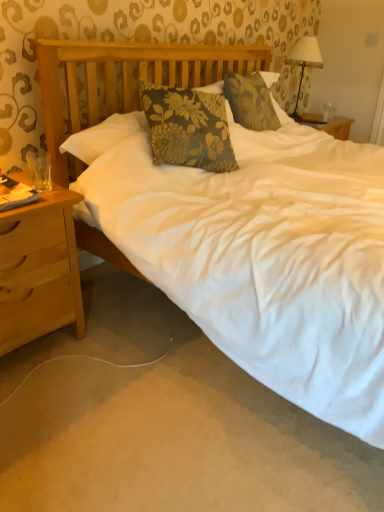
This screenshot has height=512, width=384. Describe the element at coordinates (304, 62) in the screenshot. I see `white fabric lampshade at upper right` at that location.

This screenshot has height=512, width=384. What do you see at coordinates (329, 111) in the screenshot?
I see `transparent glass at upper right` at bounding box center [329, 111].

This screenshot has height=512, width=384. Find the location of `light brown wood nightstand at left`. light brown wood nightstand at left is located at coordinates (39, 270).

In the scene shown: Considering the relative positions of white fabric lampshade at upper right and light brown wood nightstand at left in the image provided, is white fabric lampshade at upper right to the left or to the right of light brown wood nightstand at left?

Clearly, white fabric lampshade at upper right is on the right of light brown wood nightstand at left in the image.

How many degrees apart are the facing directions of white fabric lampshade at upper right and light brown wood nightstand at left?

white fabric lampshade at upper right and light brown wood nightstand at left are facing 1.76 degrees away from each other.

From the image's perspective, would you say white fabric lampshade at upper right is shown under light brown wood nightstand at left?

No.

Would you say white fabric lampshade at upper right is a long distance from light brown wood nightstand at left?

white fabric lampshade at upper right is far away from light brown wood nightstand at left.

From the image's perspective, is transparent glass at upper right below white fabric lampshade at upper right?

Correct, transparent glass at upper right appears lower than white fabric lampshade at upper right in the image.

Is transparent glass at upper right facing towards white fabric lampshade at upper right?

No, transparent glass at upper right is not turned towards white fabric lampshade at upper right.

Is transparent glass at upper right completely or partially outside of white fabric lampshade at upper right?

Yes.

Is transparent glass at upper right not near white fabric lampshade at upper right?

No, transparent glass at upper right is in close proximity to white fabric lampshade at upper right.

Which is more to the left, transparent glass at upper right or light brown wood nightstand at left?

Positioned to the left is light brown wood nightstand at left.

Is transparent glass at upper right situated inside light brown wood nightstand at left or outside?

transparent glass at upper right is spatially situated outside light brown wood nightstand at left.

The width and height of the screenshot is (384, 512). I want to click on nightstand beneath the transparent glass at upper right (from a real-world perspective), so click(x=39, y=270).

Relative to transparent glass at upper right, is light brown wood nightstand at left in front or behind?

Clearly, light brown wood nightstand at left is in front of transparent glass at upper right.

Between light brown wood nightstand at left and transparent glass at upper right, which one has larger width?

light brown wood nightstand at left is wider.

Measure the distance between light brown wood nightstand at left and transparent glass at upper right.

8.43 feet.

Is light brown wood nightstand at left to the left or to the right of transparent glass at upper right in the image?

Based on their positions, light brown wood nightstand at left is located to the left of transparent glass at upper right.

Which object is more forward, white fabric lampshade at upper right or transparent glass at upper right?

white fabric lampshade at upper right is closer to the camera.

In the scene shown: From the image's perspective, which one is positioned higher, white fabric lampshade at upper right or transparent glass at upper right?

white fabric lampshade at upper right is shown above in the image.

Is there a large distance between white fabric lampshade at upper right and transparent glass at upper right?

That's not correct — white fabric lampshade at upper right is a little close to transparent glass at upper right.

Could you tell me if white fabric lampshade at upper right is facing transparent glass at upper right?

Yes.

Is light brown wood nightstand at left wider than white fabric lampshade at upper right?

Yes.

Is light brown wood nightstand at left positioned with its back to white fabric lampshade at upper right?

light brown wood nightstand at left does not have its back to white fabric lampshade at upper right.

This screenshot has height=512, width=384. Identify the location of nightstand that appears below the white fabric lampshade at upper right (from the image's perspective). (39, 270).

Is light brown wood nightstand at left taller than white fabric lampshade at upper right?

Correct, light brown wood nightstand at left is much taller as white fabric lampshade at upper right.

Where is `lamp that is above the light brown wood nightstand at left (from a real-world perspective)`? This screenshot has height=512, width=384. lamp that is above the light brown wood nightstand at left (from a real-world perspective) is located at coordinates (304, 62).

Where is `coffee cup that is on the right side of white fabric lampshade at upper right`? coffee cup that is on the right side of white fabric lampshade at upper right is located at coordinates (329, 111).

Which object lies further to the anchor point light brown wood nightstand at left, white fabric lampshade at upper right or transparent glass at upper right?

Based on the image, transparent glass at upper right appears to be further to light brown wood nightstand at left.

Consider the image. Which object lies nearer to the anchor point white fabric lampshade at upper right, light brown wood nightstand at left or transparent glass at upper right?

Based on the image, transparent glass at upper right appears to be nearer to white fabric lampshade at upper right.

Looking at the image, which one is located closer to transparent glass at upper right, light brown wood nightstand at left or white fabric lampshade at upper right?

white fabric lampshade at upper right.

Considering their positions, is transparent glass at upper right positioned closer to light brown wood nightstand at left than white fabric lampshade at upper right?

white fabric lampshade at upper right.

Which object lies further to the anchor point transparent glass at upper right, white fabric lampshade at upper right or light brown wood nightstand at left?

Based on the image, light brown wood nightstand at left appears to be further to transparent glass at upper right.

Which object lies further to the anchor point white fabric lampshade at upper right, transparent glass at upper right or light brown wood nightstand at left?

Among the two, light brown wood nightstand at left is located further to white fabric lampshade at upper right.

You are a GUI agent. You are given a task and a screenshot of the screen. Output one action in this format:
    pyautogui.click(x=<x>, y=<y>)
    Task: Click on the lamp positioned between light brown wood nightstand at left and transparent glass at upper right from near to far
    This screenshot has height=512, width=384.
    Given the screenshot: What is the action you would take?
    pyautogui.click(x=304, y=62)